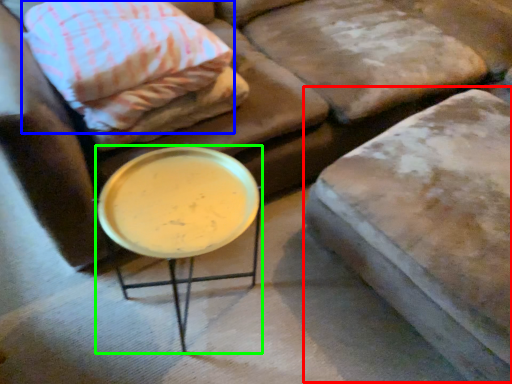
Question: Considering the real-world distances, which object is closest to swivel chair (highlighted by a red box)? pillow (highlighted by a blue box) or table (highlighted by a green box).

Choices:
 (A) pillow
 (B) table

Answer: (B)